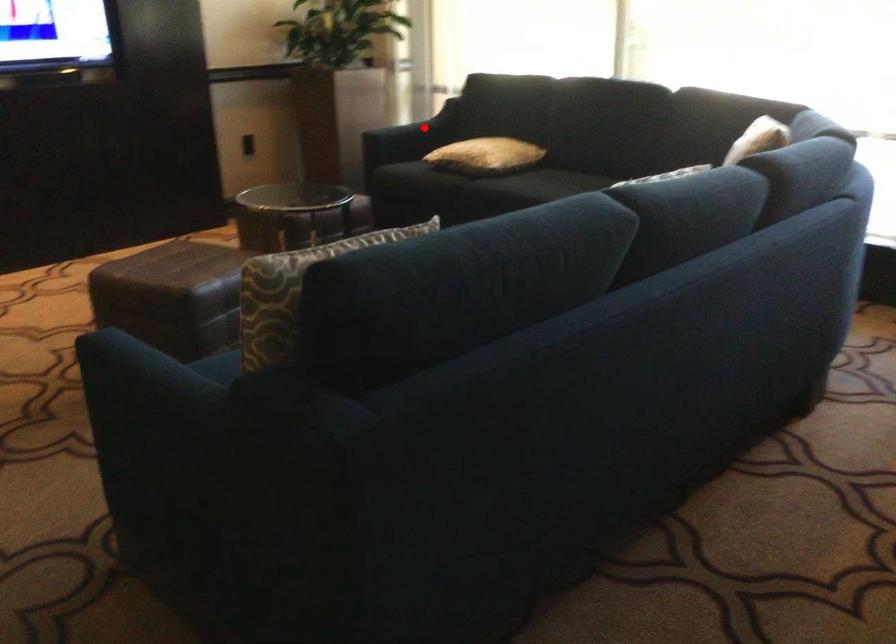
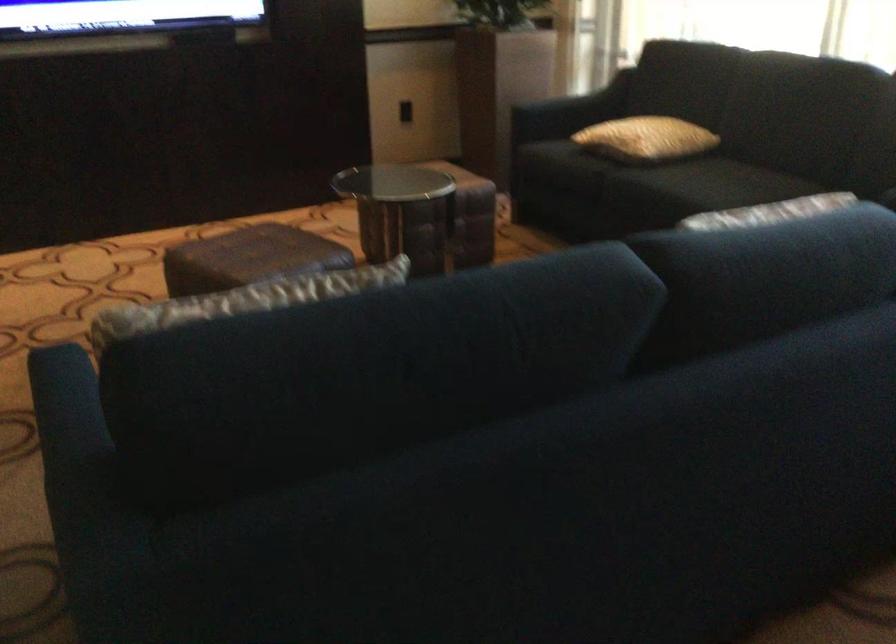
Question: I am providing you with two images of the same scene from different viewpoints. Image1 has a red point marked. In image2, the corresponding 3D location appears at what relative position? Reply with the corresponding letter.

Choices:
 (A) Closer
 (B) Farther

Answer: (A)